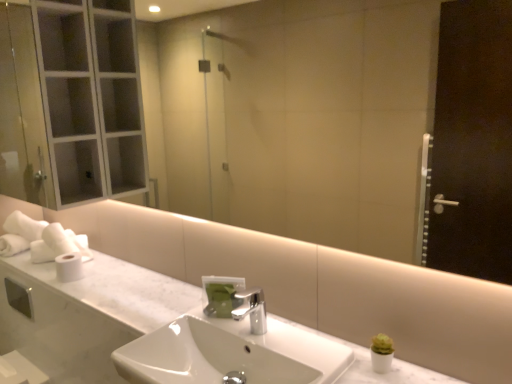
Identify the location of blank space above white marble counter top at center (from a real-world perspective). This screenshot has width=512, height=384. (128, 289).